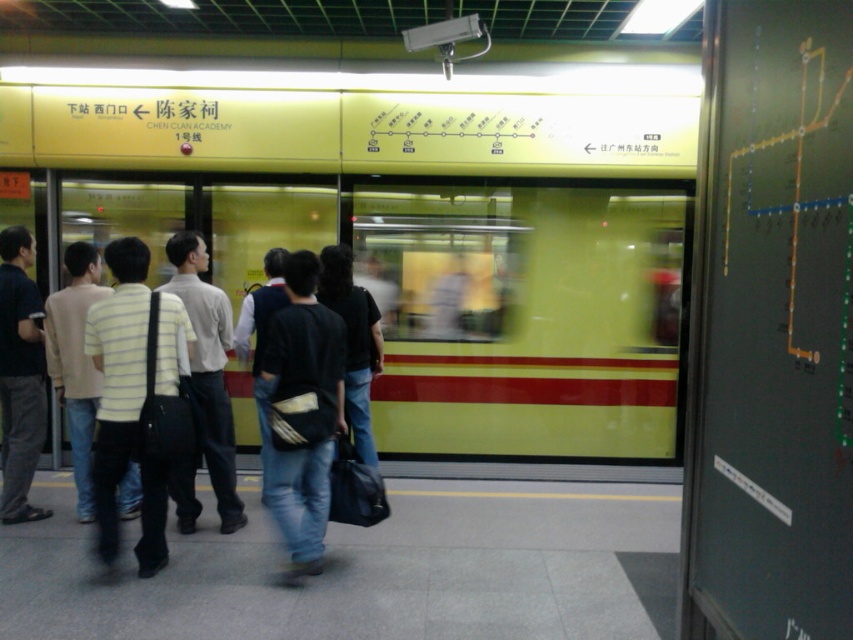
You are a photographer trying to capture a photo of both the yellow matte train at center and the striped cotton shirt at center in the subway station. Which object should you focus on first if you want to include both in your frame without moving the camera?

The yellow matte train at center is larger in size than the striped cotton shirt at center, so you should focus on the larger object first to ensure it fits within the frame before adjusting for the smaller one.

You are a photographer standing on the subway platform. You want to take a photo of the yellow matte train at center and the striped cotton shirt at center in the scene. Which object should you zoom in on to ensure both fit in the frame without cropping?

The yellow matte train at center is wider than the striped cotton shirt at center, so you should zoom in on the yellow matte train at center to ensure both fit in the frame without cropping.